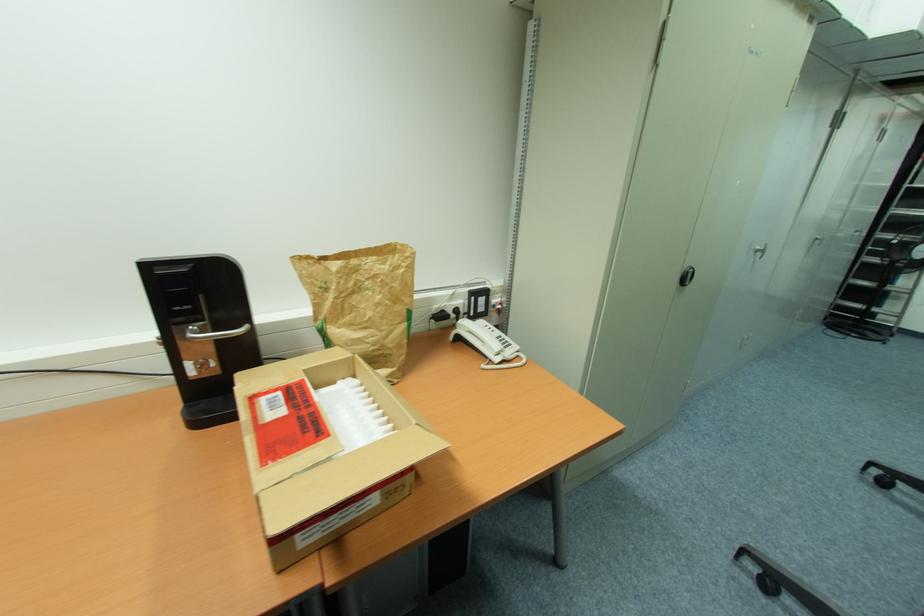
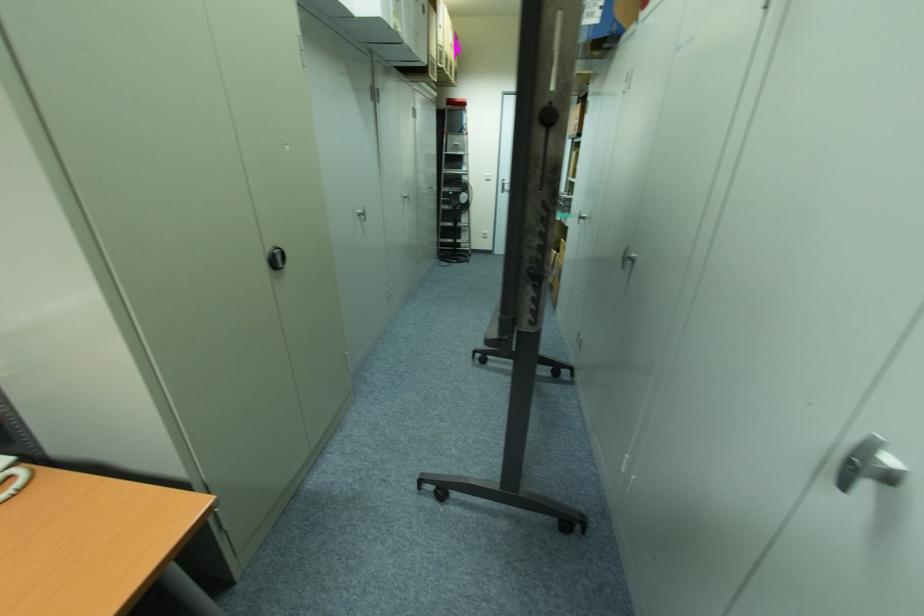
Where in the second image is the point corresponding to [517,357] from the first image?

(8, 479)